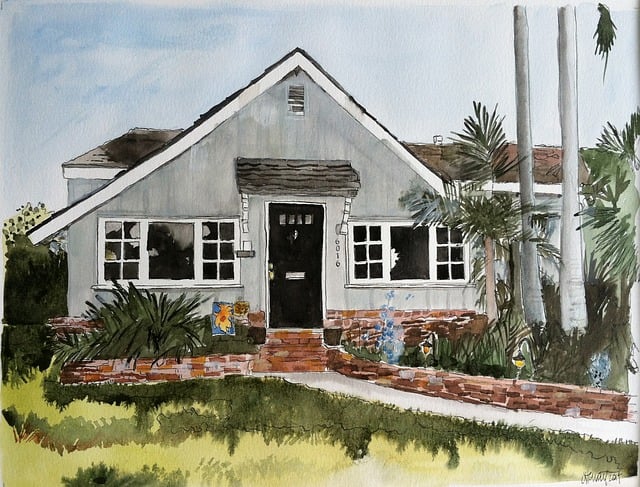
Where is `vent`? The height and width of the screenshot is (487, 640). vent is located at coordinates (294, 99).